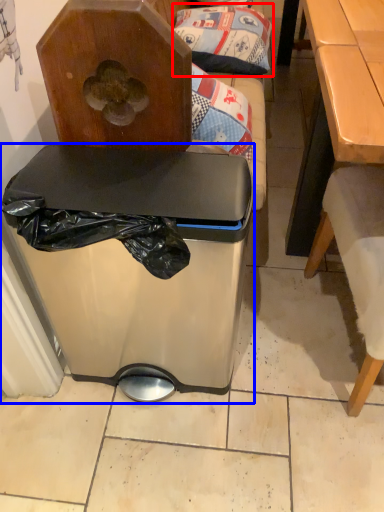
Question: Which of the following is the farthest to the observer, pillow (highlighted by a red box) or trash bin/can (highlighted by a blue box)?

Choices:
 (A) pillow
 (B) trash bin/can

Answer: (A)